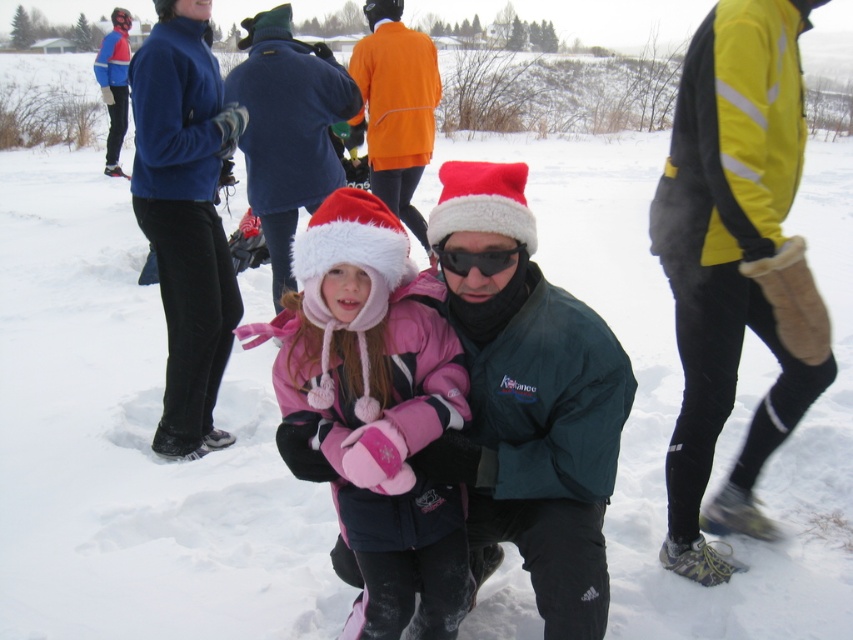
Is point (746, 129) closer to camera compared to point (363, 563)?

No, (746, 129) is further to viewer.

Is point (753, 452) positioned after point (389, 257)?

Yes, point (753, 452) is behind point (389, 257).

Identify the location of yellow reflective jacket at right. (735, 264).

Is pink fleece jacket at center thinner than orange fleece jacket at upper center?

No.

Can you confirm if pink fleece jacket at center is wider than orange fleece jacket at upper center?

Yes.

Is point (383, 250) positioned in front of point (372, 54)?

Yes, it is.

Image resolution: width=853 pixels, height=640 pixels. I want to click on pink fleece jacket at center, so click(x=376, y=410).

Who is lower down, blue fleece jacket at upper left or black reflective goggles at center?

Positioned lower is black reflective goggles at center.

Is blue fleece jacket at upper left to the left of black reflective goggles at center from the viewer's perspective?

Yes, blue fleece jacket at upper left is to the left of black reflective goggles at center.

Between point (201, 356) and point (480, 273), which one is positioned in front?

Point (480, 273) is in front.

At what (x,y) coordinates should I click in order to perform the action: click on blue fleece jacket at upper left. Please return your answer as a coordinate pair (x, y). This screenshot has width=853, height=640. Looking at the image, I should click on (184, 216).